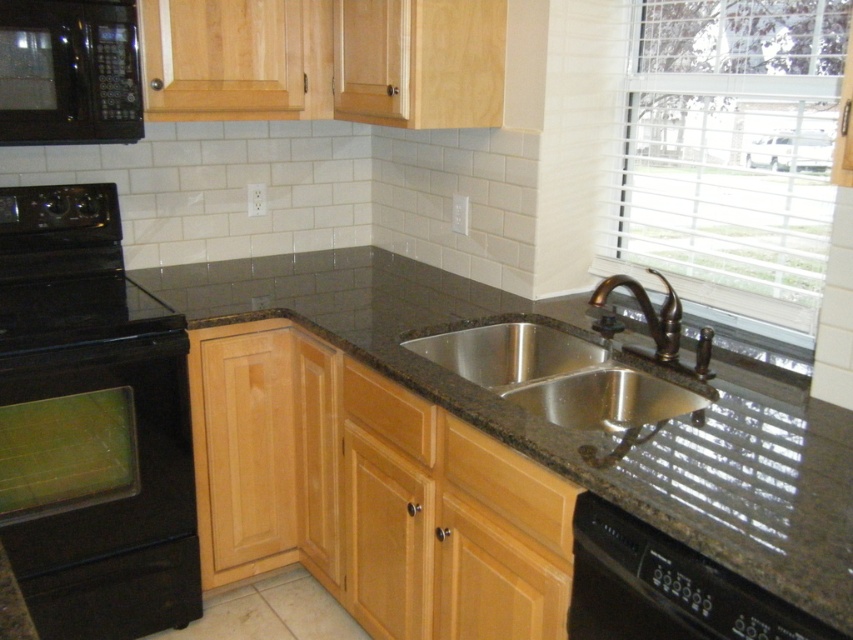
Is granite at center positioned before black plastic dishwasher at lower right?

Yes.

Is granite at center wider than black plastic dishwasher at lower right?

Indeed, granite at center has a greater width compared to black plastic dishwasher at lower right.

Does point (830, 563) lie behind point (669, 636)?

No.

Find the location of a particular element. Image resolution: width=853 pixels, height=640 pixels. granite at center is located at coordinates (589, 435).

Who is more distant from viewer, (729, 417) or (334, 624)?

The point (334, 624) is behind.

Is granite at center further to camera compared to brown granite countertop at lower center?

No, it is in front of brown granite countertop at lower center.

Which is in front, point (676, 497) or point (218, 628)?

Point (676, 497) is in front.

Find the location of `granite at center`. granite at center is located at coordinates click(x=589, y=435).

The width and height of the screenshot is (853, 640). Identify the location of black glossy oven at left. (94, 392).

From the picture: Which is above, black glossy oven at left or brown granite countertop at lower center?

Positioned higher is black glossy oven at left.

Find the location of a particular element. black glossy oven at left is located at coordinates (94, 392).